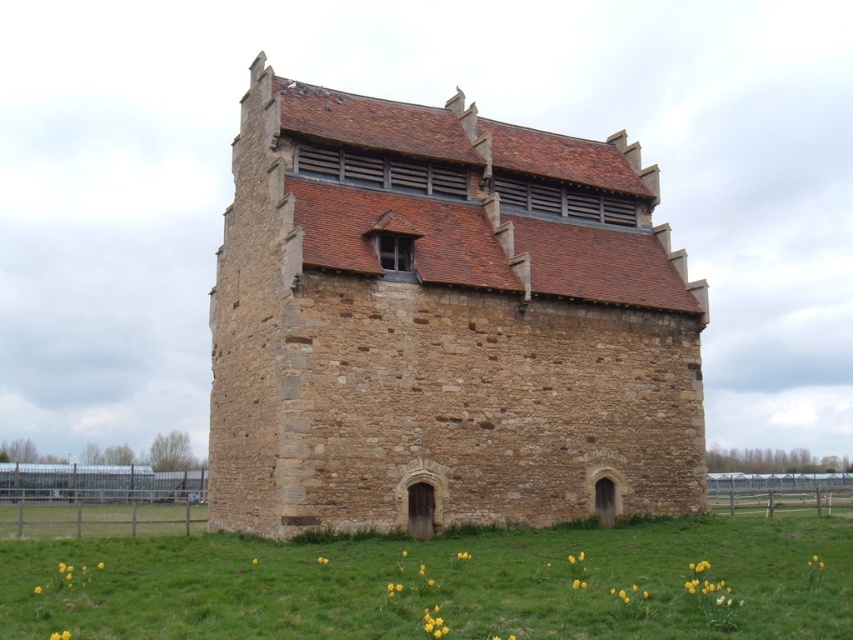
Question: Does brown stone tower at center appear on the right side of green grass at lower center?

Choices:
 (A) yes
 (B) no

Answer: (B)

Question: Observing the image, what is the correct spatial positioning of brown stone tower at center in reference to green grass at lower center?

Choices:
 (A) left
 (B) right

Answer: (A)

Question: Among these points, which one is nearest to the camera?

Choices:
 (A) (556, 145)
 (B) (77, 595)

Answer: (B)

Question: Observing the image, what is the correct spatial positioning of brown stone tower at center in reference to green grass at lower center?

Choices:
 (A) above
 (B) below

Answer: (A)